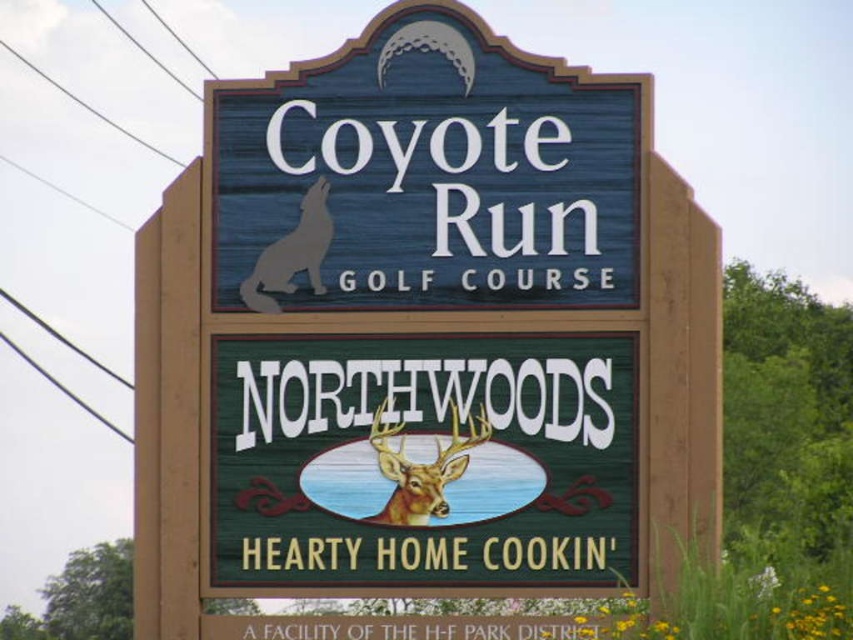
Between point (383, 518) and point (318, 234), which one is positioned behind?

The point (318, 234) is behind.

Where is `shiny brown deer at center`? This screenshot has height=640, width=853. shiny brown deer at center is located at coordinates (421, 468).

Between point (456, 323) and point (318, 248), which one is positioned in front?

Point (456, 323)

Can you confirm if wooden sign at center is smaller than gray matte wolf at upper left?

Actually, wooden sign at center might be larger than gray matte wolf at upper left.

Does point (421, 317) come closer to viewer compared to point (317, 182)?

Yes, it is.

Locate an element on the screen. This screenshot has height=640, width=853. wooden sign at center is located at coordinates (424, 339).

Does wooden sign at center lie in front of shiny brown deer at center?

Yes, wooden sign at center is in front of shiny brown deer at center.

Which is above, wooden sign at center or shiny brown deer at center?

wooden sign at center is above.

Between point (699, 552) and point (380, 465), which one is positioned behind?

The point (380, 465) is more distant.

I want to click on wooden sign at center, so click(x=424, y=339).